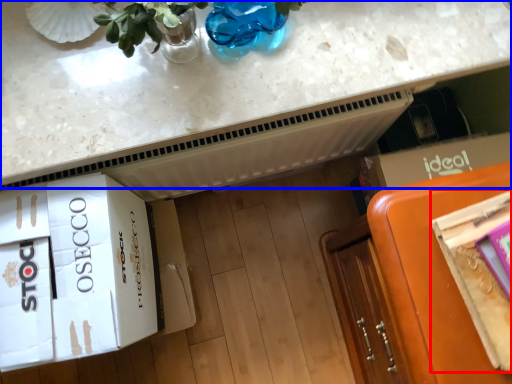
Question: Which object is further to the camera taking this photo, magazine (highlighted by a red box) or countertop (highlighted by a blue box)?

Choices:
 (A) magazine
 (B) countertop

Answer: (B)